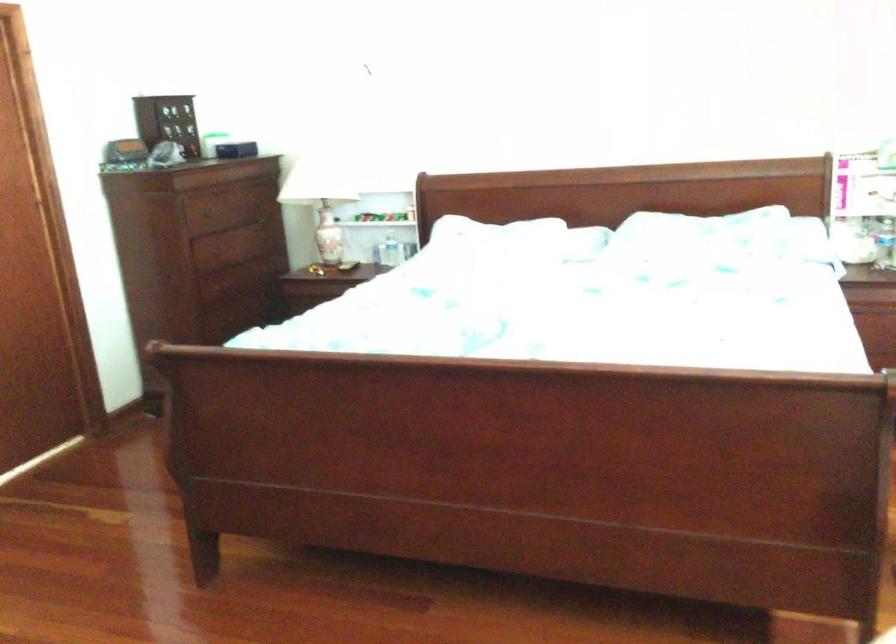
What do you see at coordinates (209, 252) in the screenshot? The image size is (896, 644). I see `the dresser drawer pull` at bounding box center [209, 252].